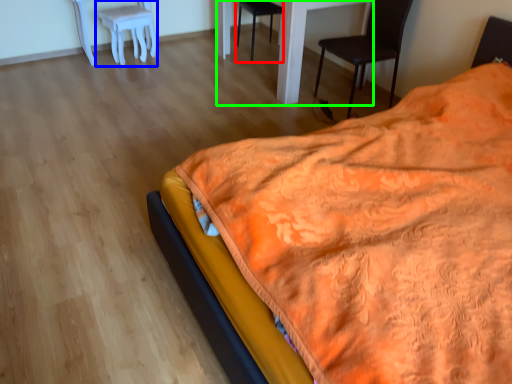
Question: Which is nearer to the chair (highlighted by a red box)? stool (highlighted by a blue box) or table (highlighted by a green box).

Choices:
 (A) stool
 (B) table

Answer: (A)